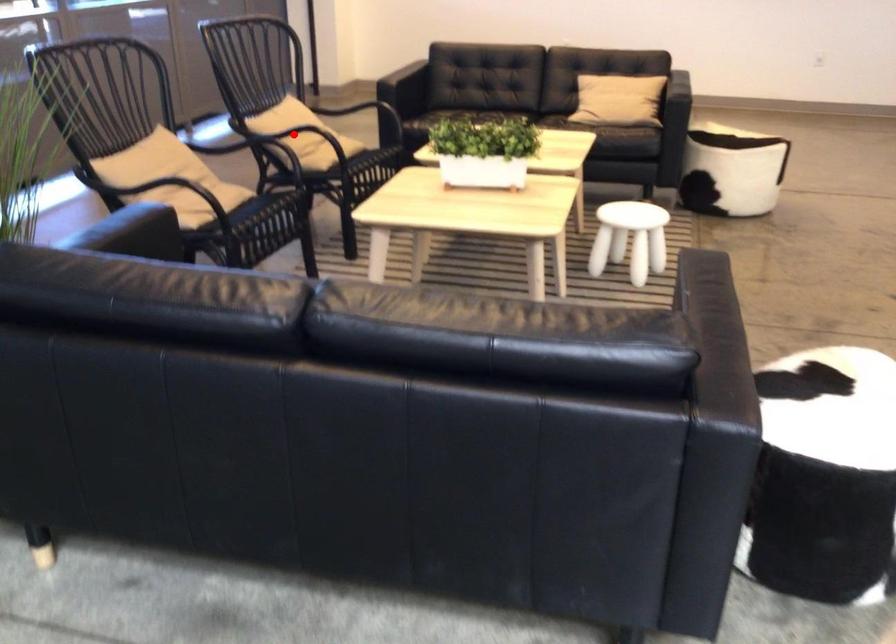
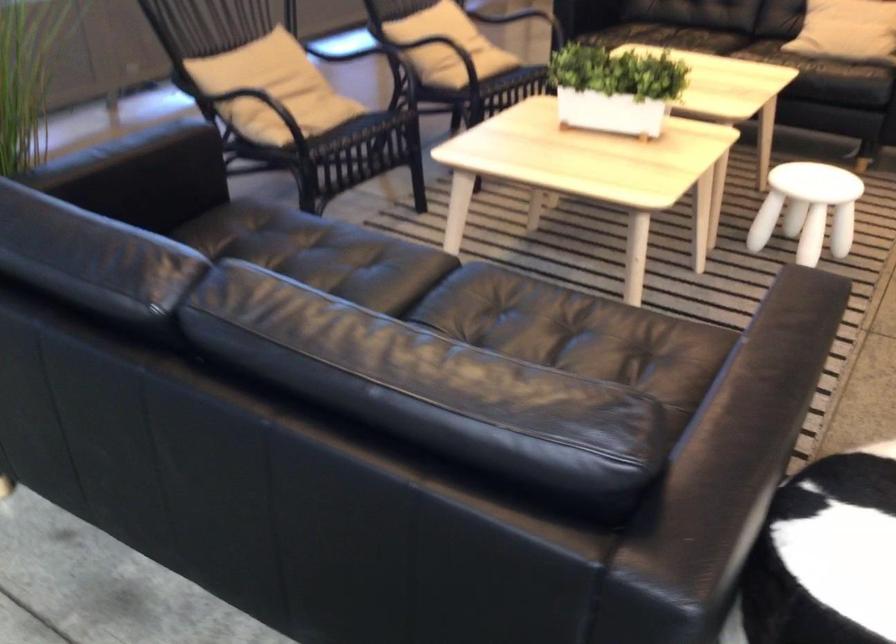
Find the pixel in the second image that matches the highlighted location in the first image.

(433, 43)